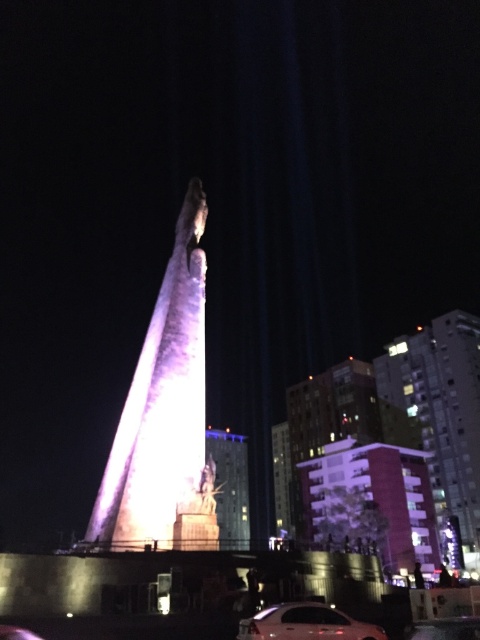
Question: Is shiny silver sedan at center bigger than shiny metallic statue at center?

Choices:
 (A) no
 (B) yes

Answer: (A)

Question: Which object is the closest to the shiny silver sedan at center?

Choices:
 (A) illuminated stone tower at center
 (B) shiny metallic statue at center

Answer: (A)

Question: Which point is closer to the camera?

Choices:
 (A) shiny silver sedan at center
 (B) illuminated stone tower at center
 (C) shiny metallic statue at center
 (D) pink concrete building at right

Answer: (A)

Question: Is illuminated stone tower at center to the right of shiny metallic statue at center from the viewer's perspective?

Choices:
 (A) no
 (B) yes

Answer: (A)

Question: Which object appears farthest from the camera in this image?

Choices:
 (A) shiny silver sedan at center
 (B) pink concrete building at right
 (C) illuminated stone tower at center

Answer: (B)

Question: Observing the image, what is the correct spatial positioning of shiny silver sedan at center in reference to shiny metallic statue at center?

Choices:
 (A) right
 (B) left

Answer: (A)